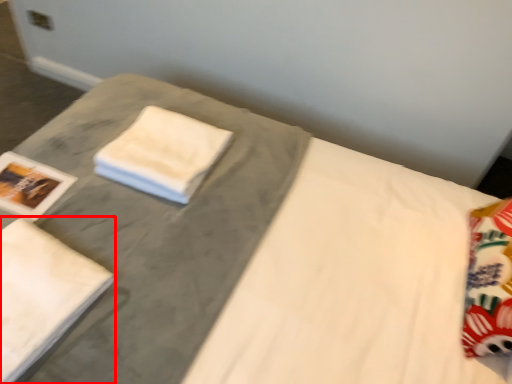
Question: From the image's perspective, what is the correct spatial relationship of bath towel (annotated by the red box) in relation to cloth?

Choices:
 (A) above
 (B) below

Answer: (B)